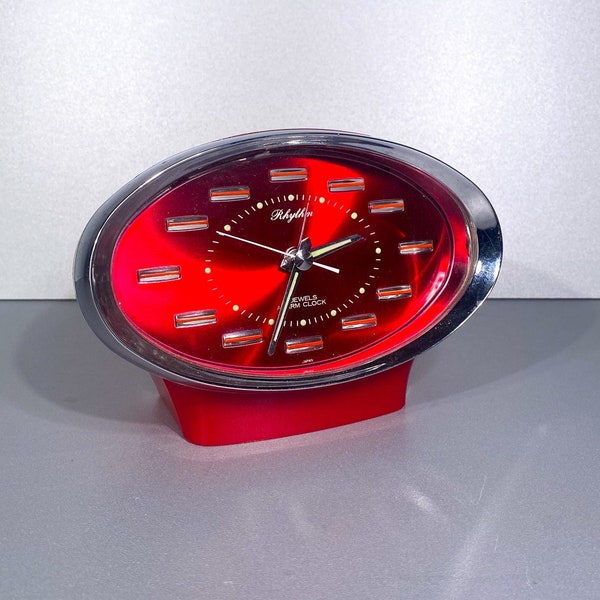
This screenshot has height=600, width=600. What are the coordinates of `base of clock` in the screenshot? It's located at (296, 415).